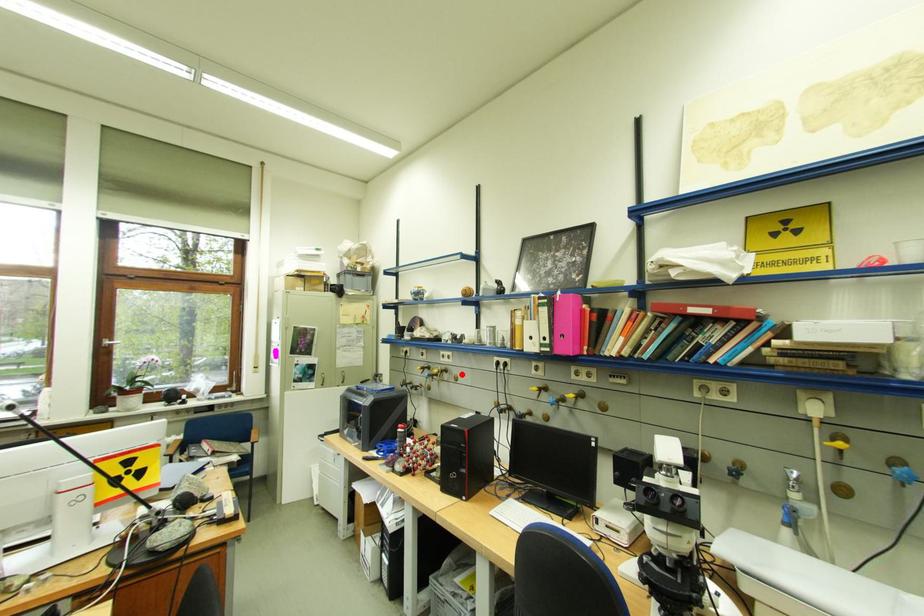
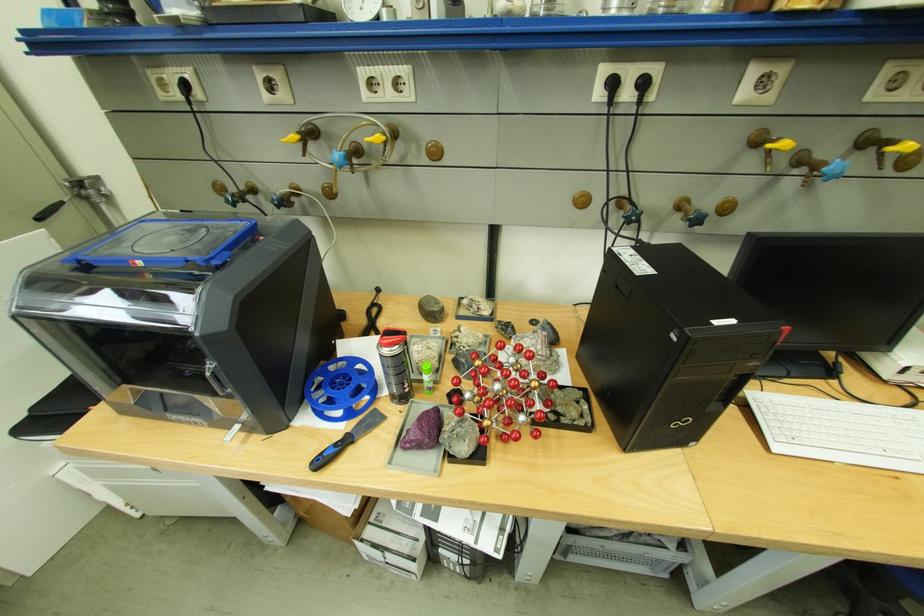
Find the pixel in the second image that matches the highlighted location in the first image.

(428, 140)